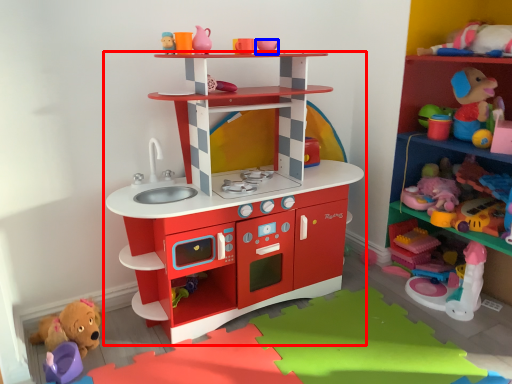
Question: Which of the following is the farthest to the observer, shelf (highlighted by a red box) or toy (highlighted by a blue box)?

Choices:
 (A) shelf
 (B) toy

Answer: (B)